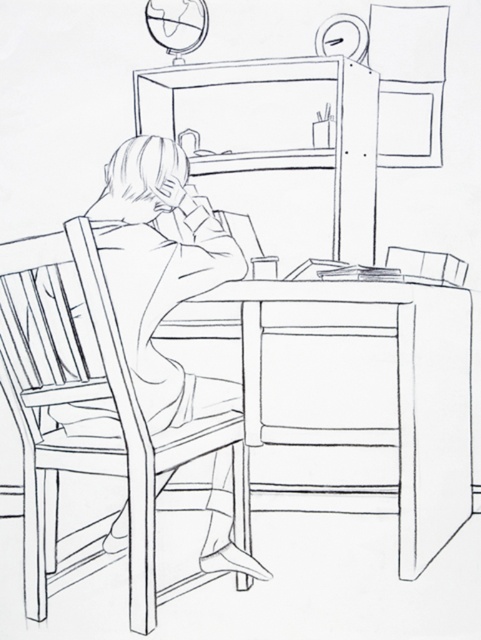
You are organizing a small meeting in the room where the wooden chair at left and the wooden chair at right are located. If you want to seat two people comfortably, which chair should you choose for the person who needs more space?

The wooden chair at left should be chosen because its width is larger than the wooden chair at right, providing more space for the person.

You are standing in front of the desk and want to place a small object on the desk. The coordinates of the two points on the desk are point (194, 291) and point (406, 256). Which point is closer to you?

Point (194, 291) is in front of point (406, 256), so it is closer to you.

Based on the scene description, what object is located at the coordinates point (341, 397)?

The point (341, 397) corresponds to the wooden table at center.